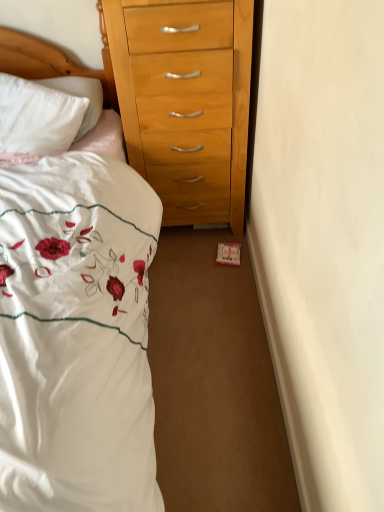
Question: Which is correct: white embroidered fabric at left is inside wooden headboard at upper left, or outside of it?

Choices:
 (A) inside
 (B) outside

Answer: (B)

Question: Based on their positions, is white embroidered fabric at left located to the left or right of wooden headboard at upper left?

Choices:
 (A) right
 (B) left

Answer: (A)

Question: From a real-world perspective, is white embroidered fabric at left above or below wooden headboard at upper left?

Choices:
 (A) above
 (B) below

Answer: (B)

Question: Is point (82, 138) positioned closer to the camera than point (1, 334)?

Choices:
 (A) closer
 (B) farther

Answer: (B)

Question: Would you say wooden headboard at upper left is to the left or to the right of white embroidered fabric at left in the picture?

Choices:
 (A) right
 (B) left

Answer: (B)

Question: From their relative heights in the image, would you say wooden headboard at upper left is taller or shorter than white embroidered fabric at left?

Choices:
 (A) tall
 (B) short

Answer: (B)

Question: From the image's perspective, is wooden headboard at upper left positioned above or below white embroidered fabric at left?

Choices:
 (A) above
 (B) below

Answer: (A)